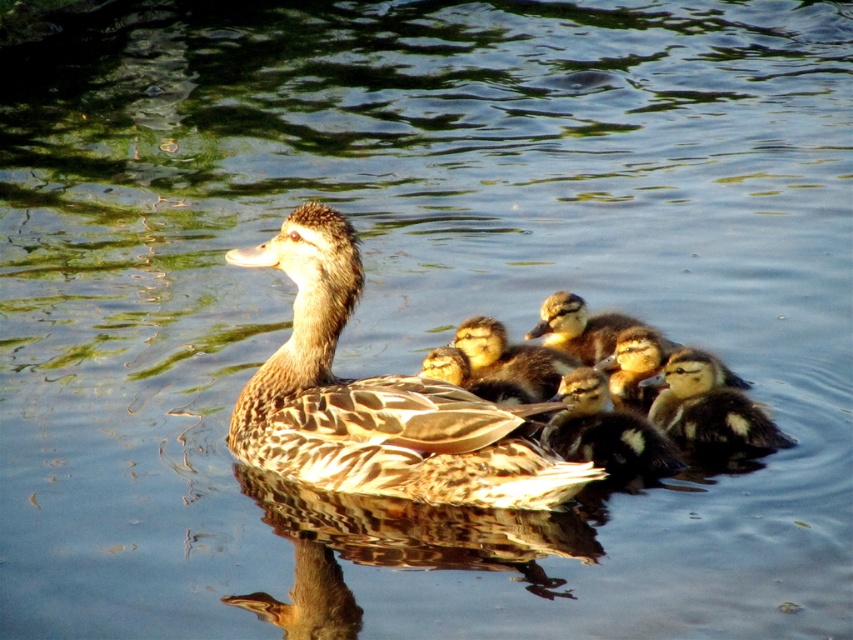
You are a wildlife photographer aiming to capture a closeup of the brown speckled duckling at center and the brown fuzzy ducklings at center. Given that your camera can only focus on one duckling at a time, which duckling should you choose to ensure the photo is in focus if you want the largest subject?

The brown speckled duckling at center is larger in size than the brown fuzzy ducklings at center, so you should focus on the brown speckled duckling at center to capture the largest subject in focus.

You are a photographer trying to capture the mother duck and her ducklings. You notice two points marked in the scene. The first point is at coordinate point[276,454] and the second is at point[544,337]. Which point is closer to the camera?

Point[276,454] is in front of point[544,337], so it is closer to the camera.

Consider the image. You are standing at a point 5 meters away from the camera. You want to reach the point marked as point (x=305, y=285) in the image. Can you reach it without moving closer than 4 meters to the camera?

The distance between point (x=305, y=285) and the camera is 4.53 meters. Since you are currently 5 meters away from the camera, moving towards the point would bring you to 4.53 meters, which is within your requirement of not moving closer than 4 meters. Therefore, yes, you can reach it without violating the distance constraint.